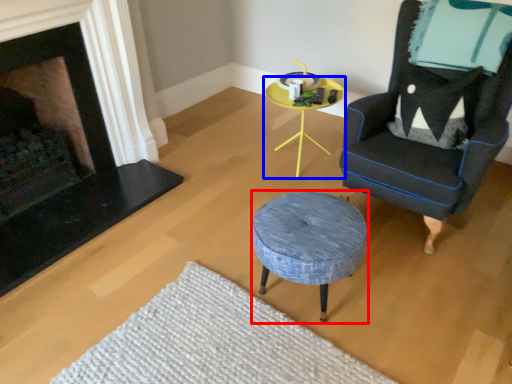
Question: Which point is closer to the camera, stool (highlighted by a red box) or table (highlighted by a blue box)?

Choices:
 (A) stool
 (B) table

Answer: (A)